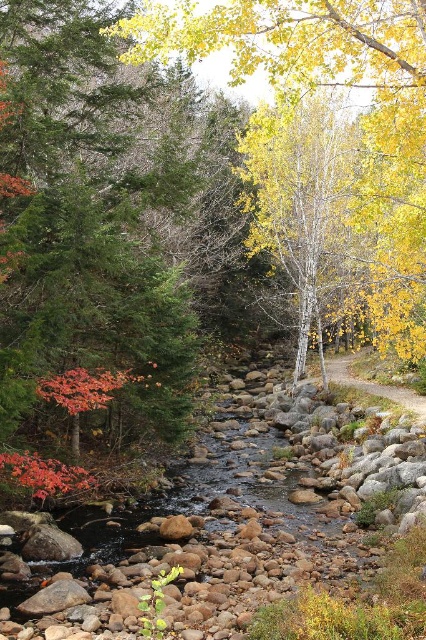
You are standing at the edge of the stream and want to take a photo of the smooth white birch at center. If your camera has a maximum focus range of 20 meters, will you be able to capture it clearly?

The smooth white birch at center is 19.45 meters away from the camera. Since this distance is within the camera maximum focus range of 20 meters, you can capture it clearly.

You are standing at the edge of the stream and want to take a photo of the smooth white birch at center. Where should you position yourself to capture it in the frame?

Position yourself at the edge of the stream closest to the smooth white birch at center, which is located at point (x=301, y=196) in the image to ensure it is centered in your photo.